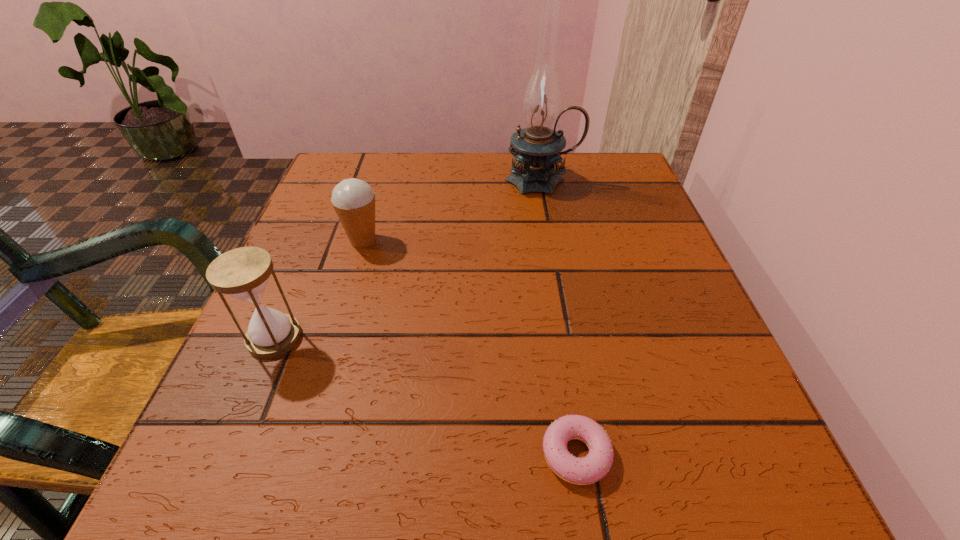
Locate an element on the screen. The image size is (960, 540). vacant area at the left edge of the desktop is located at coordinates (302, 314).

The image size is (960, 540). In order to click on vacant space at the far left corner in this screenshot , I will do `click(390, 183)`.

Locate an element on the screen. The height and width of the screenshot is (540, 960). vacant space at the near left corner of the desktop is located at coordinates (180, 490).

Find the location of `free space at the far right corner of the desktop`. free space at the far right corner of the desktop is located at coordinates (621, 193).

The height and width of the screenshot is (540, 960). In the image, there is a desktop. Identify the location of blank space at the near right corner. click(735, 447).

Where is `unoccupied area between the doughnut and the icecream`? unoccupied area between the doughnut and the icecream is located at coordinates (469, 347).

In order to click on vacant region between the third nearest object and the oil lamp in this screenshot , I will do coord(453,210).

Identify the location of vacant area that lies between the third farthest object and the farthest object. The image size is (960, 540). (408, 259).

Find the location of `free spot between the leftmost object and the second object from left to right`. free spot between the leftmost object and the second object from left to right is located at coordinates (319, 289).

You are a GUI agent. You are given a task and a screenshot of the screen. Output one action in this format:
    pyautogui.click(x=<x>, y=<y>)
    Task: Click on the free spot between the hourglass and the tallest object
    This screenshot has height=540, width=960.
    Given the screenshot: What is the action you would take?
    pyautogui.click(x=408, y=259)